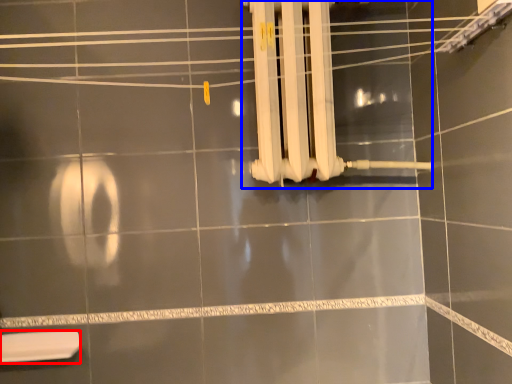
Question: Which object is closer to the camera taking this photo, toilet (highlighted by a red box) or shower (highlighted by a blue box)?

Choices:
 (A) toilet
 (B) shower

Answer: (B)